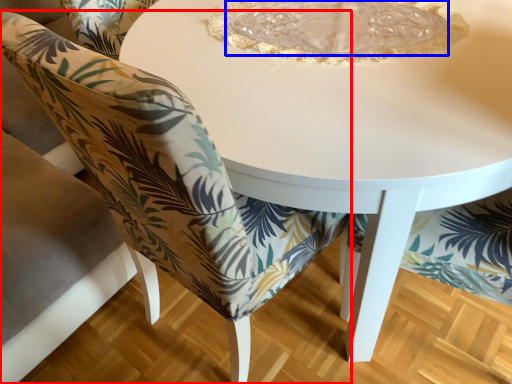
Question: Which point is further to the camera, chair (highlighted by a red box) or glass plate (highlighted by a blue box)?

Choices:
 (A) chair
 (B) glass plate

Answer: (B)